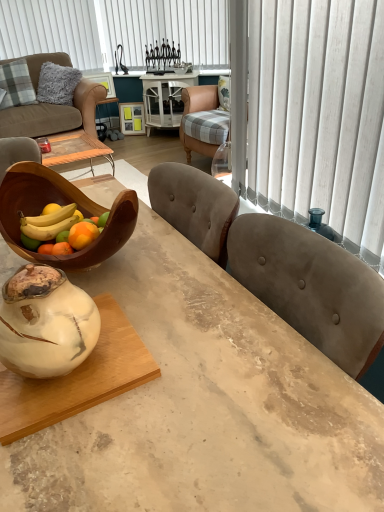
Find the location of a particular element. free point above white marble coffee table at lower left (from a real-world perspective) is located at coordinates (92, 356).